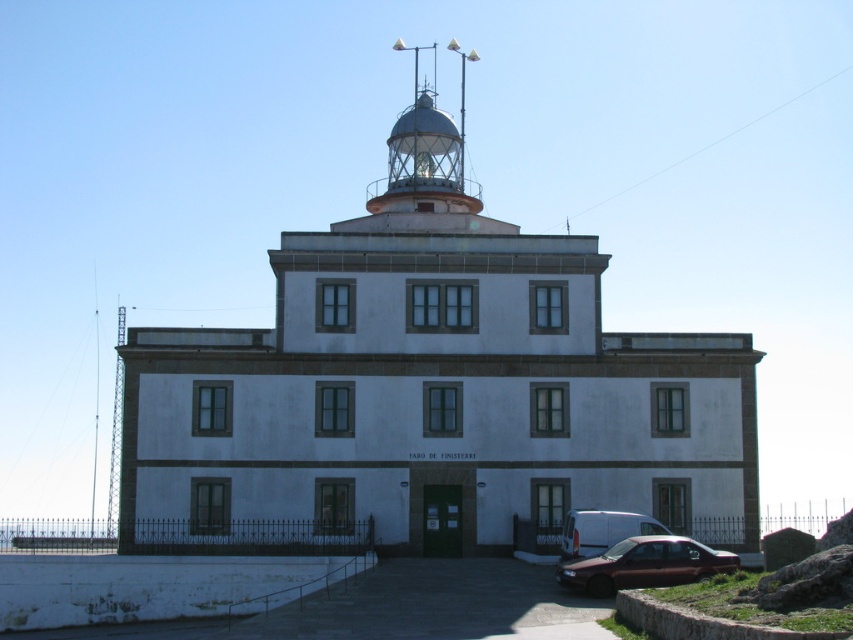
Question: Among these objects, which one is nearest to the camera?

Choices:
 (A) metallic silver van at lower center
 (B) shiny maroon sedan at lower right
 (C) white stone tower at center

Answer: (B)

Question: From the image, what is the correct spatial relationship of white stone tower at center in relation to metallic silver van at lower center?

Choices:
 (A) left
 (B) right

Answer: (A)

Question: Considering the relative positions of shiny maroon sedan at lower right and metallic silver van at lower center in the image provided, where is shiny maroon sedan at lower right located with respect to metallic silver van at lower center?

Choices:
 (A) right
 (B) left

Answer: (A)

Question: Which point is farther to the camera?

Choices:
 (A) (618, 515)
 (B) (730, 554)
 (C) (410, 156)

Answer: (C)

Question: Which point is farther to the camera?

Choices:
 (A) metallic dome at upper center
 (B) white stone tower at center
 (C) shiny maroon sedan at lower right
 (D) metallic silver van at lower center

Answer: (A)

Question: In this image, where is white stone tower at center located relative to metallic dome at upper center?

Choices:
 (A) above
 (B) below

Answer: (B)